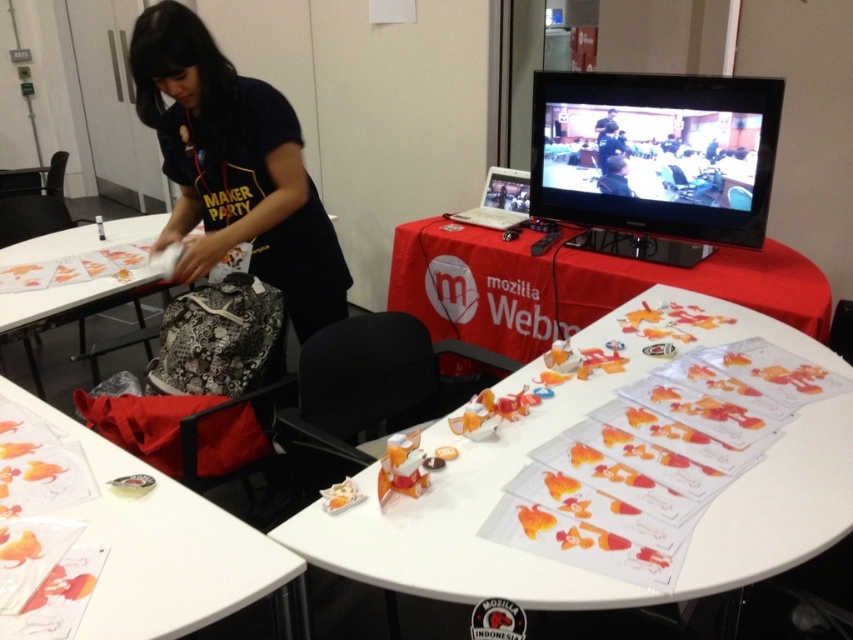
Where is the white paper at center located?

The white paper at center is located at point [503,481].

You are attending a Mozilla Webmaker workshop and notice two items on the table. The first is a white paper at center, and the second is a dark blue shirt at upper left. From your perspective, which item is positioned to the right of the other?

The white paper at center is to the right of the dark blue shirt at upper left, so the white paper at center is positioned to the right of the dark blue shirt at upper left.

You are attending a Mozilla Webmaker workshop and notice two items on the table. Which item is positioned to the right of the other? The dark blue shirt at upper left and the white paper at left.

The dark blue shirt at upper left is to the right of the white paper at left.